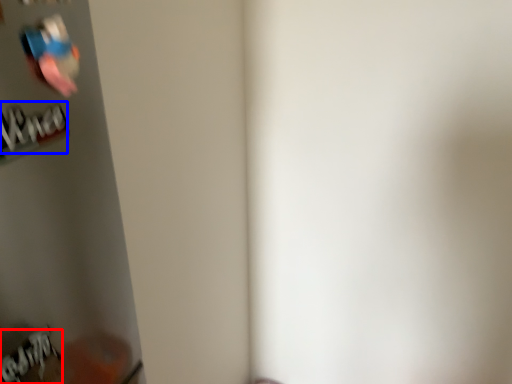
Question: Which of the following is the closest to the observer, writing (highlighted by a red box) or writing (highlighted by a blue box)?

Choices:
 (A) writing
 (B) writing

Answer: (B)